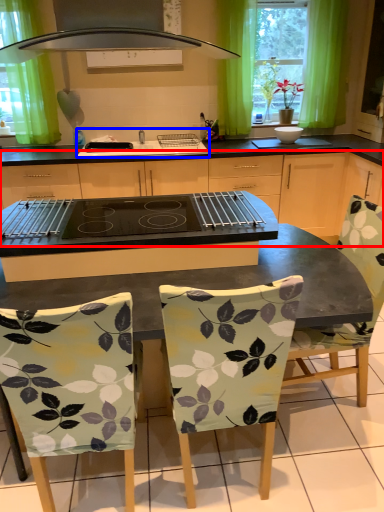
Question: Which point is further to the camera, cabinetry (highlighted by a red box) or sink (highlighted by a blue box)?

Choices:
 (A) cabinetry
 (B) sink

Answer: (B)